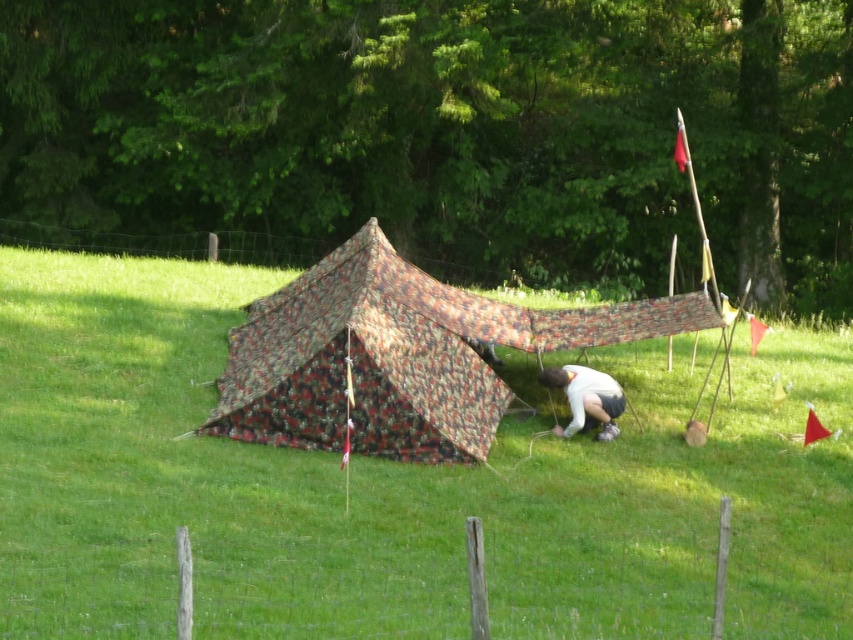
Does point (664, 604) come farther from viewer compared to point (659, 312)?

No, it is in front of (659, 312).

Is green grass at center wider than camouflage fabric tent at center?

Indeed, green grass at center has a greater width compared to camouflage fabric tent at center.

Identify the location of green grass at center. This screenshot has height=640, width=853. (392, 486).

Can you confirm if camouflage fabric tent at center is positioned to the left of white fabric at center?

Yes, camouflage fabric tent at center is to the left of white fabric at center.

Who is positioned more to the right, camouflage fabric tent at center or white fabric at center?

white fabric at center is more to the right.

Which is behind, point (537, 321) or point (598, 376)?

Positioned behind is point (537, 321).

The width and height of the screenshot is (853, 640). In order to click on camouflage fabric tent at center in this screenshot , I will do `click(399, 355)`.

Measure the distance between green grass at center and white fabric at center.

They are 1.86 meters apart.

I want to click on green grass at center, so click(392, 486).

Does point (119, 492) lie in front of point (593, 413)?

That is True.

The height and width of the screenshot is (640, 853). Identify the location of green grass at center. (392, 486).